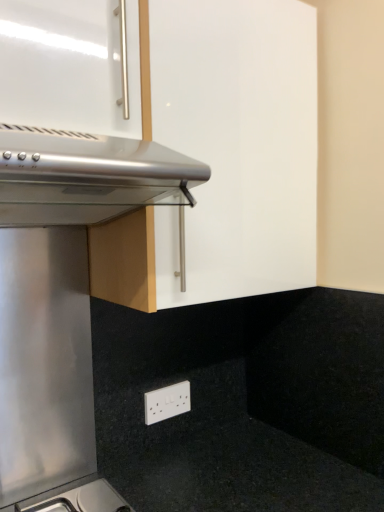
Question: From the image's perspective, does matte white cabinet at upper center appear lower than white plastic electric outlet at lower center?

Choices:
 (A) yes
 (B) no

Answer: (B)

Question: Considering the relative sizes of matte white cabinet at upper center and white plastic electric outlet at lower center in the image provided, is matte white cabinet at upper center shorter than white plastic electric outlet at lower center?

Choices:
 (A) yes
 (B) no

Answer: (B)

Question: Can you confirm if matte white cabinet at upper center is smaller than white plastic electric outlet at lower center?

Choices:
 (A) yes
 (B) no

Answer: (B)

Question: From a real-world perspective, is matte white cabinet at upper center positioned under white plastic electric outlet at lower center based on gravity?

Choices:
 (A) yes
 (B) no

Answer: (B)

Question: Is matte white cabinet at upper center oriented away from white plastic electric outlet at lower center?

Choices:
 (A) no
 (B) yes

Answer: (A)

Question: From the image's perspective, is white plastic electric outlet at lower center above or below satin silver oven at upper left?

Choices:
 (A) below
 (B) above

Answer: (A)

Question: Is white plastic electric outlet at lower center bigger or smaller than satin silver oven at upper left?

Choices:
 (A) big
 (B) small

Answer: (B)

Question: In terms of height, does white plastic electric outlet at lower center look taller or shorter compared to satin silver oven at upper left?

Choices:
 (A) tall
 (B) short

Answer: (B)

Question: Is white plastic electric outlet at lower center to the left or to the right of satin silver oven at upper left in the image?

Choices:
 (A) right
 (B) left

Answer: (A)

Question: Do you think satin silver oven at upper left is within white plastic electric outlet at lower center, or outside of it?

Choices:
 (A) inside
 (B) outside

Answer: (B)

Question: Is satin silver oven at upper left bigger or smaller than white plastic electric outlet at lower center?

Choices:
 (A) big
 (B) small

Answer: (A)

Question: Considering the positions of point (1, 81) and point (187, 410), is point (1, 81) closer or farther from the camera than point (187, 410)?

Choices:
 (A) closer
 (B) farther

Answer: (A)

Question: In terms of height, does satin silver oven at upper left look taller or shorter compared to white plastic electric outlet at lower center?

Choices:
 (A) short
 (B) tall

Answer: (B)

Question: From their relative heights in the image, would you say white plastic electric outlet at lower center is taller or shorter than matte white cabinet at upper center?

Choices:
 (A) tall
 (B) short

Answer: (B)

Question: From a real-world perspective, is white plastic electric outlet at lower center above or below matte white cabinet at upper center?

Choices:
 (A) above
 (B) below

Answer: (B)